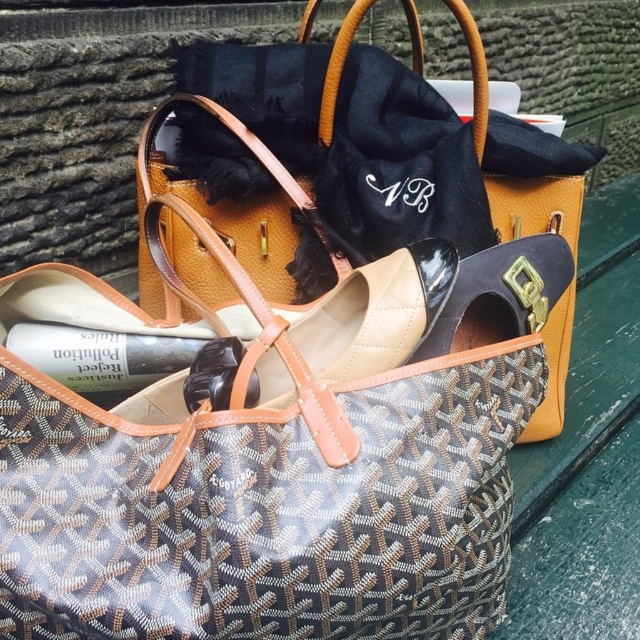
Does brown textured bag at center have a lesser height compared to beige patent leather shoe at center?

No, brown textured bag at center is not shorter than beige patent leather shoe at center.

Between brown textured bag at center and beige patent leather shoe at center, which one appears on the right side from the viewer's perspective?

Positioned to the right is brown textured bag at center.

The image size is (640, 640). Describe the element at coordinates (372, 177) in the screenshot. I see `brown textured bag at center` at that location.

Find the location of a particular element. Image resolution: width=640 pixels, height=640 pixels. brown textured bag at center is located at coordinates (372, 177).

Is brown textured tote at center to the left of beige patent leather shoe at center from the viewer's perspective?

Incorrect, brown textured tote at center is not on the left side of beige patent leather shoe at center.

Is brown textured tote at center taller than beige patent leather shoe at center?

Indeed, brown textured tote at center has a greater height compared to beige patent leather shoe at center.

Find the location of a particular element. This screenshot has width=640, height=640. brown textured tote at center is located at coordinates (260, 508).

Which is more to the right, brown textured tote at center or brown textured bag at center?

From the viewer's perspective, brown textured bag at center appears more on the right side.

Is the position of brown textured tote at center more distant than that of brown textured bag at center?

No.

This screenshot has height=640, width=640. What are the coordinates of `brown textured tote at center` in the screenshot? It's located at (260, 508).

Where is `brown textured tote at center`? brown textured tote at center is located at coordinates (260, 508).